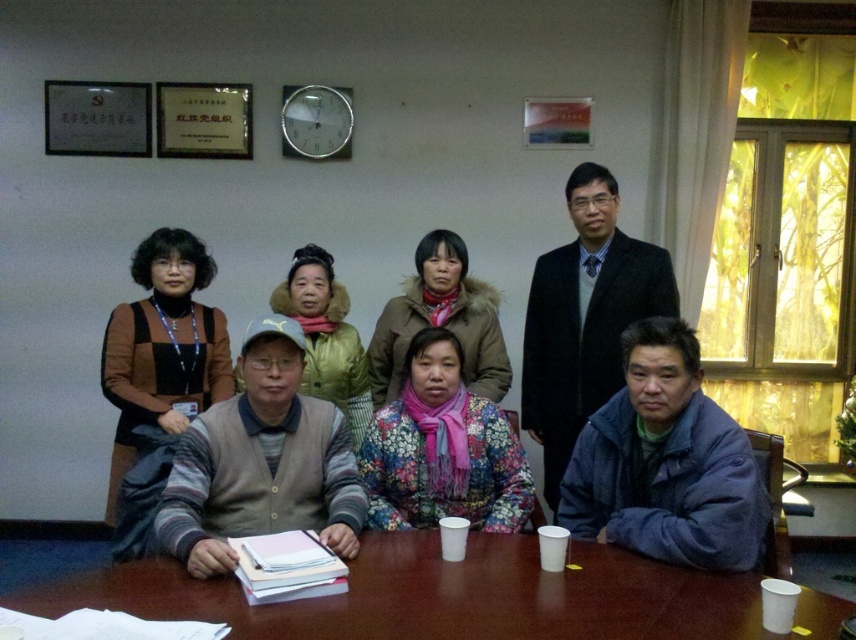
Question: Is the position of brown wooden table at center less distant than that of fluffy brown coat at center?

Choices:
 (A) yes
 (B) no

Answer: (A)

Question: Estimate the real-world distances between objects in this image. Which object is farther from the matte yellow jacket at center?

Choices:
 (A) brown knitted sweater at upper left
 (B) floral fabric scarf at center

Answer: (B)

Question: Is floral fabric scarf at center further to camera compared to brown knitted sweater at upper left?

Choices:
 (A) yes
 (B) no

Answer: (B)

Question: Which object is positioned farthest from the brown wooden table at center?

Choices:
 (A) fluffy brown coat at center
 (B) brown knitted sweater at upper left
 (C) matte yellow jacket at center
 (D) floral fabric scarf at center

Answer: (C)

Question: Is fluffy brown coat at center above matte yellow jacket at center?

Choices:
 (A) no
 (B) yes

Answer: (B)

Question: Which point appears closest to the camera in this image?

Choices:
 (A) (413, 445)
 (B) (510, 611)
 (C) (189, 397)

Answer: (B)